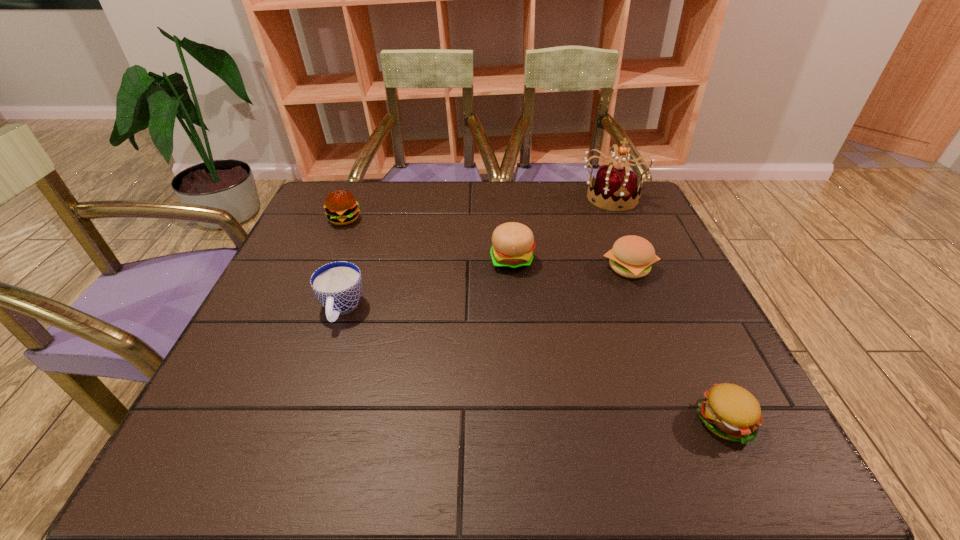
Locate an element on the screen. The image size is (960, 540). blank space located 0.300m on the back of the nearest hamburger is located at coordinates (661, 283).

The height and width of the screenshot is (540, 960). I want to click on tiara that is positioned at the far edge, so click(614, 189).

You are a GUI agent. You are given a task and a screenshot of the screen. Output one action in this format:
    pyautogui.click(x=<x>, y=<y>)
    Task: Click on the hamburger at the far edge
    The image size is (960, 540).
    Given the screenshot: What is the action you would take?
    pyautogui.click(x=341, y=207)

Locate an element on the screen. The image size is (960, 540). object that is at the near edge is located at coordinates (729, 411).

Locate an element on the screen. hamburger positioned at the left edge is located at coordinates 341,207.

This screenshot has width=960, height=540. I want to click on cup that is at the left edge, so click(337, 285).

The image size is (960, 540). Find the location of `tiara located at the right edge`. tiara located at the right edge is located at coordinates (614, 189).

Locate an element on the screen. The image size is (960, 540). object at the far left corner is located at coordinates (341, 207).

The width and height of the screenshot is (960, 540). Find the location of `object positioned at the far right corner`. object positioned at the far right corner is located at coordinates (614, 189).

The width and height of the screenshot is (960, 540). I want to click on object at the near right corner, so click(729, 411).